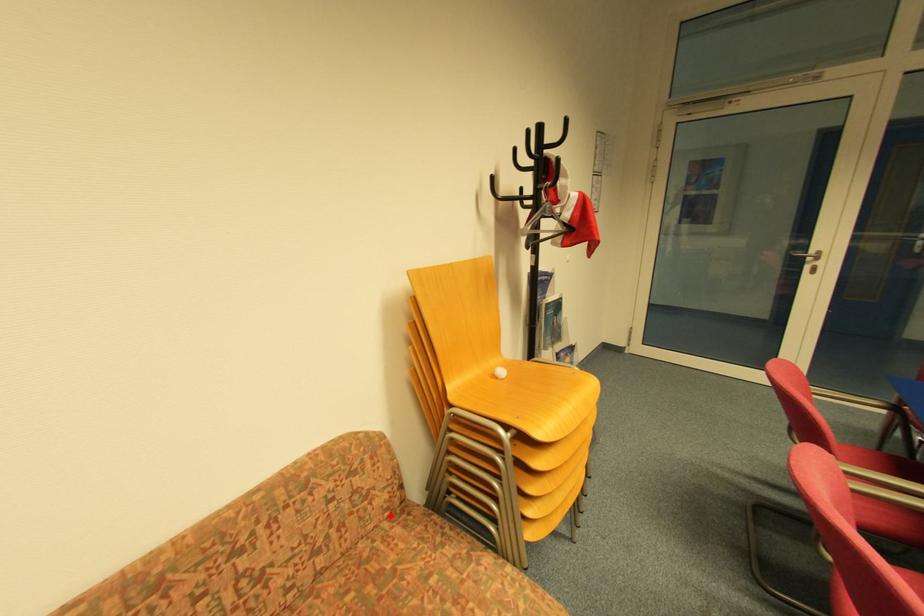
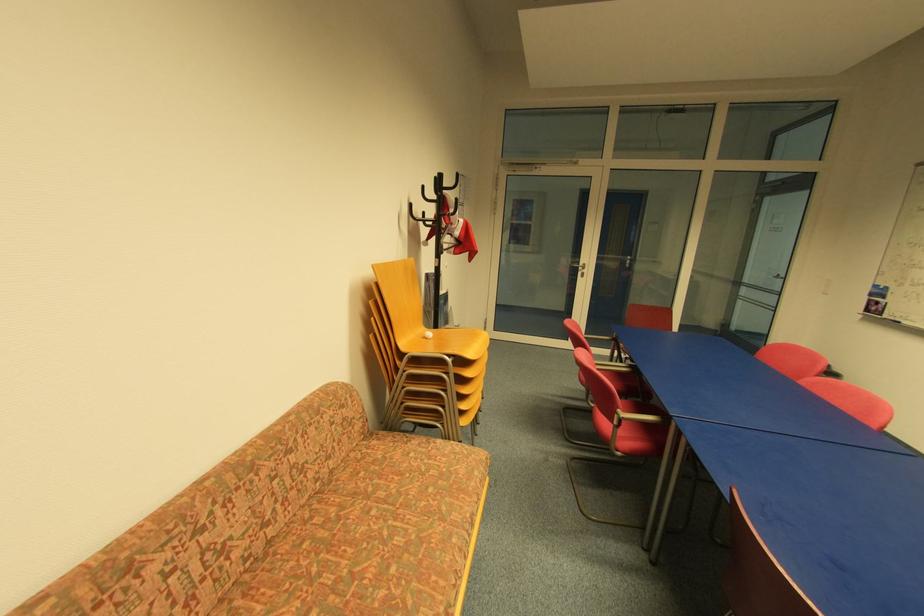
Find the pixel in the second image that matches the highlighted location in the first image.

(367, 438)